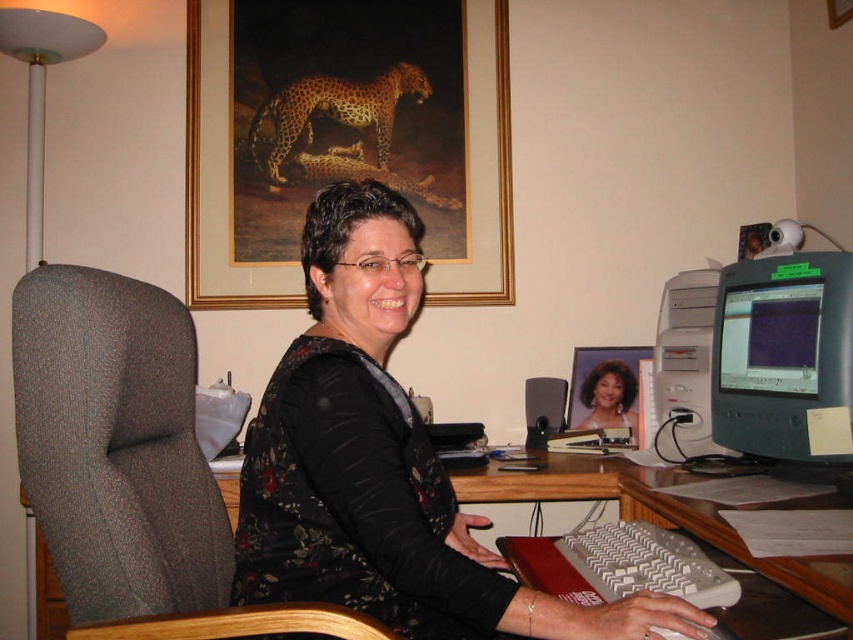
Question: Which object appears farthest from the camera in this image?

Choices:
 (A) matte black monitor at right
 (B) gold-framed picture at upper center
 (C) black floral dress at center

Answer: (B)

Question: Estimate the real-world distances between objects in this image. Which object is farther from the gold-framed picture at upper center?

Choices:
 (A) gray fabric swivel chair at left
 (B) black floral dress at center
 (C) matte plastic monitor at center right

Answer: (B)

Question: Can you confirm if gray fabric swivel chair at left is bigger than matte black monitor at right?

Choices:
 (A) yes
 (B) no

Answer: (A)

Question: Can you confirm if gray fabric swivel chair at left is thinner than matte plastic monitor at center right?

Choices:
 (A) yes
 (B) no

Answer: (B)

Question: Can you confirm if gold-framed picture at upper center is positioned to the left of smooth skin woman at center?

Choices:
 (A) yes
 (B) no

Answer: (A)

Question: Which of the following is the closest to the observer?

Choices:
 (A) (804, 369)
 (B) (602, 378)

Answer: (A)